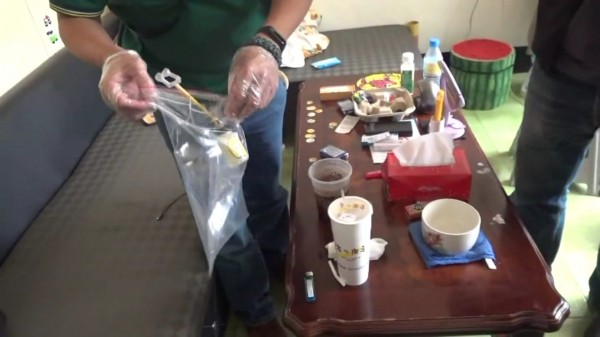
Identify the location of red tissue box. This screenshot has width=600, height=337. pos(391,181).